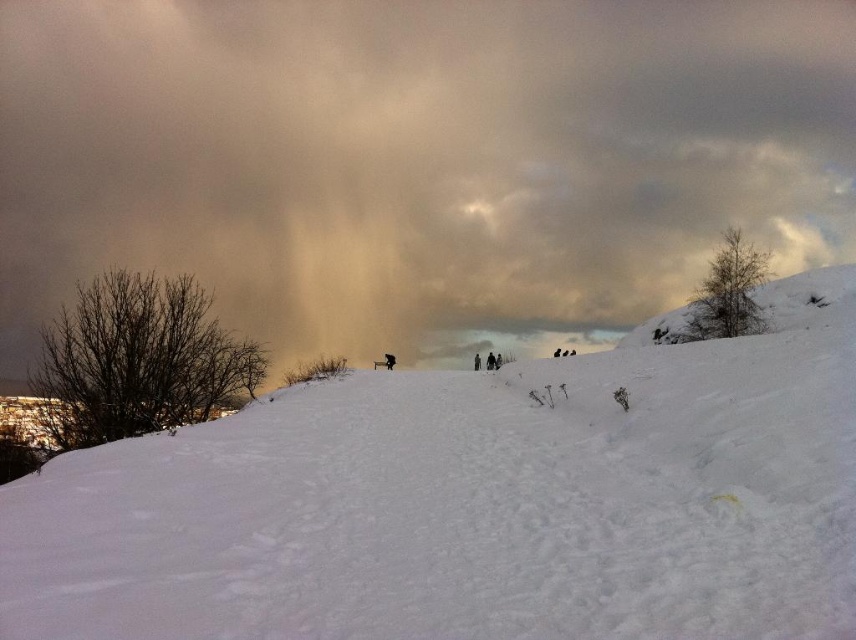
You are a photographer wanting to capture the cloudy sky at upper center and the white fluffy snow at center in a single frame. Which object will occupy more horizontal space in your photo?

The cloudy sky at upper center will occupy more horizontal space in the photo because its width surpasses that of the white fluffy snow at center.

You are standing on the snow slope and looking up at the cloudy sky at upper center and the white fluffy snow at center. Which one is higher from your viewpoint?

The cloudy sky at upper center is higher than the white fluffy snow at center from your viewpoint.

You are standing in the winter landscape and notice the cloudy sky at upper center and the white fluffy snow at center. Which object is closer to you?

The cloudy sky at upper center is closer to you because it is further to the viewer than the white fluffy snow at center.